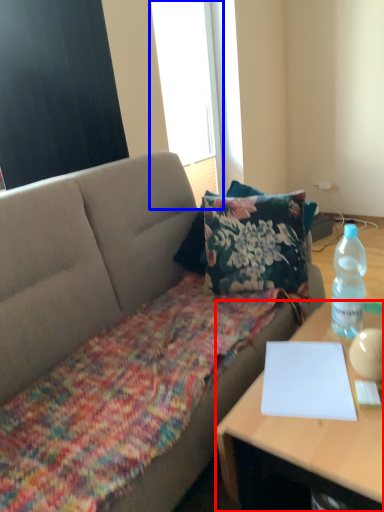
Question: Among these objects, which one is nearest to the camera, desk (highlighted by a red box) or window screen (highlighted by a blue box)?

Choices:
 (A) desk
 (B) window screen

Answer: (A)